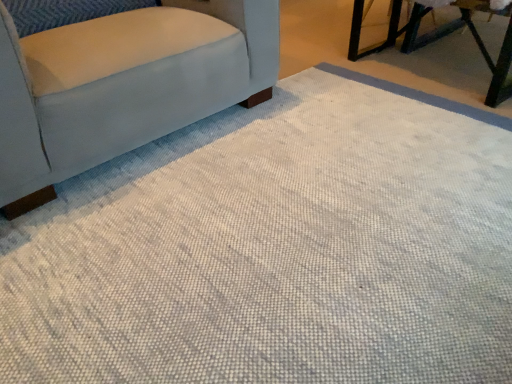
Question: Is light gray fabric chair at left completely or partially inside metallic green table at upper right?

Choices:
 (A) no
 (B) yes

Answer: (A)

Question: Considering the relative positions of metallic green table at upper right and light gray fabric chair at left in the image provided, is metallic green table at upper right to the right of light gray fabric chair at left from the viewer's perspective?

Choices:
 (A) no
 (B) yes

Answer: (B)

Question: Can you confirm if metallic green table at upper right is taller than light gray fabric chair at left?

Choices:
 (A) no
 (B) yes

Answer: (A)

Question: Considering the relative sizes of metallic green table at upper right and light gray fabric chair at left in the image provided, is metallic green table at upper right thinner than light gray fabric chair at left?

Choices:
 (A) no
 (B) yes

Answer: (B)

Question: Does metallic green table at upper right have a greater width compared to light gray fabric chair at left?

Choices:
 (A) yes
 (B) no

Answer: (B)

Question: Can you confirm if metallic green table at upper right is positioned to the left of light gray fabric chair at left?

Choices:
 (A) yes
 (B) no

Answer: (B)

Question: Is metallic green table at upper right completely or partially inside light gray fabric chair at left?

Choices:
 (A) yes
 (B) no

Answer: (B)

Question: From a real-world perspective, does light gray fabric chair at left sit lower than metallic green table at upper right?

Choices:
 (A) yes
 (B) no

Answer: (B)

Question: Is light gray fabric chair at left far away from metallic green table at upper right?

Choices:
 (A) yes
 (B) no

Answer: (A)

Question: Is light gray fabric chair at left turned away from metallic green table at upper right?

Choices:
 (A) yes
 (B) no

Answer: (B)

Question: Is light gray fabric chair at left at the left side of metallic green table at upper right?

Choices:
 (A) yes
 (B) no

Answer: (A)

Question: Considering the relative positions of light gray fabric chair at left and metallic green table at upper right in the image provided, is light gray fabric chair at left in front of metallic green table at upper right?

Choices:
 (A) no
 (B) yes

Answer: (B)

Question: Considering the relative positions of metallic green table at upper right and light gray fabric chair at left in the image provided, is metallic green table at upper right to the left or to the right of light gray fabric chair at left?

Choices:
 (A) right
 (B) left

Answer: (A)